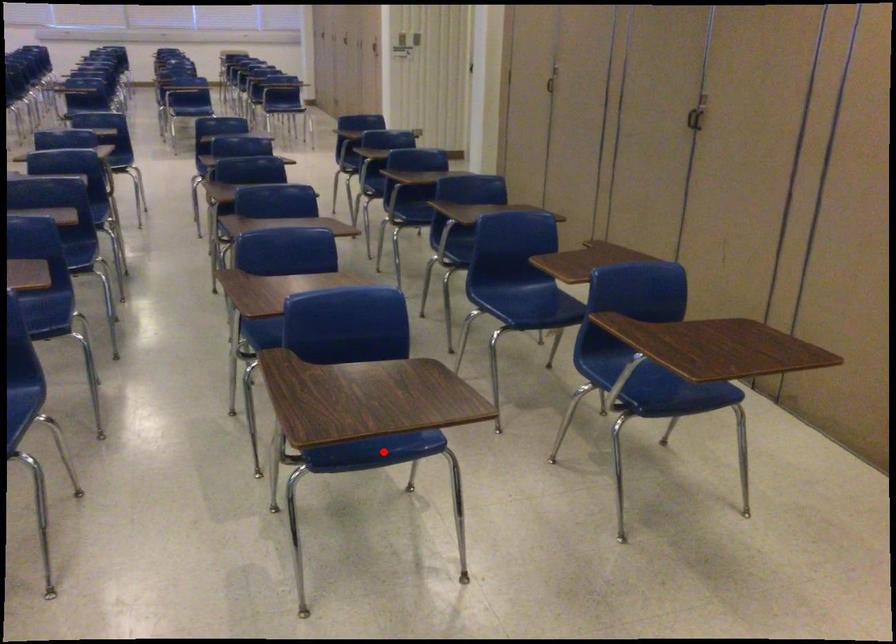
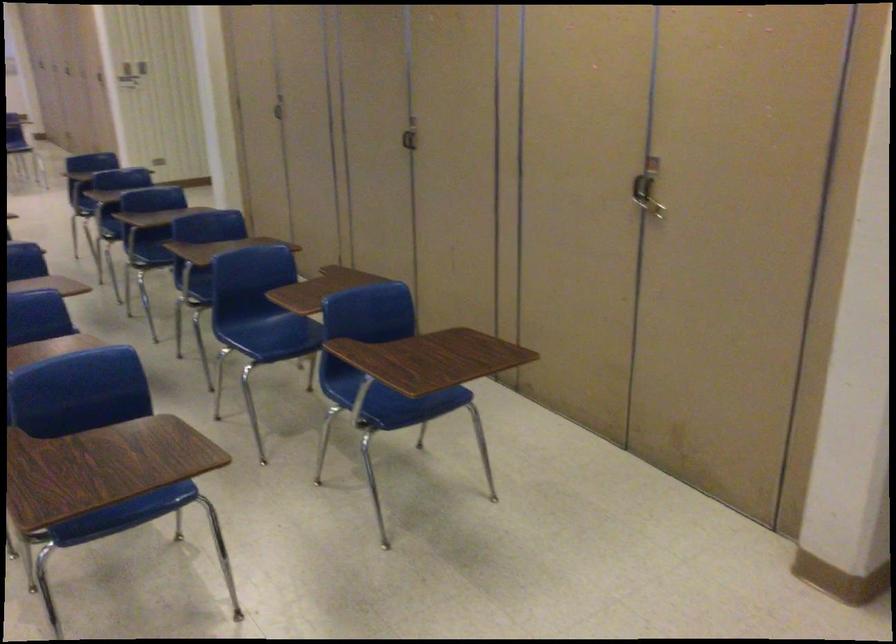
Find the pixel in the second image that matches the highlighted location in the first image.

(126, 516)